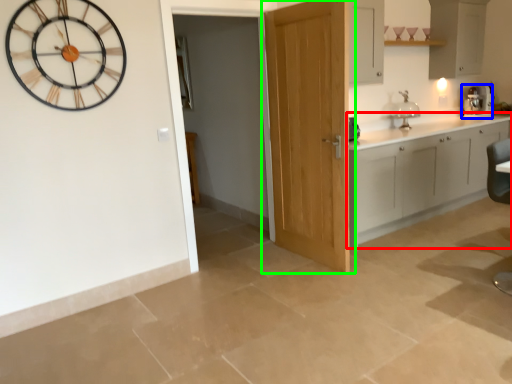
Question: Which object is positioned closest to cabinetry (highlighted by a red box)? Select from coffee machine (highlighted by a blue box) and door (highlighted by a green box).

Choices:
 (A) coffee machine
 (B) door

Answer: (B)